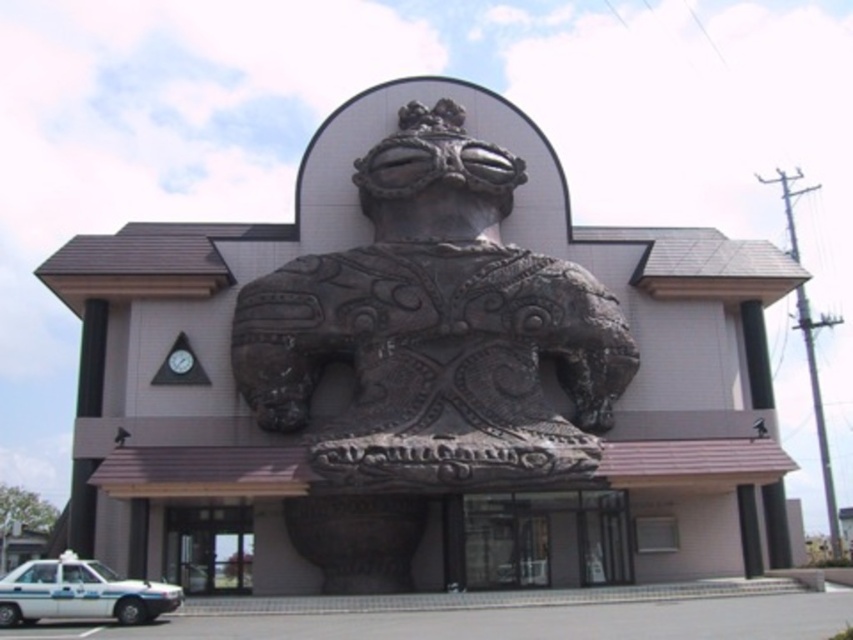
You are standing in front of the building and want to take a photo of the rustic stone statue at center. Where should you position yourself to ensure the statue is centered in your camera viewfinder?

The rustic stone statue at center is already positioned at the center coordinates of the image, so standing directly in front of the building and aligning your camera with the statue will ensure it is centered in your viewfinder.

You are standing in front of the building and notice two points marked on the facade. The first point is at coordinates point (453, 344) and the second is at point (74, 577). Which point is closer to you?

Point (74, 577) is closer to you because it is closer to the camera than point (453, 344), which is further away.

You are standing in front of the building and want to locate the point at coordinates (434, 332). Based on the scene description, where would this point be located?

The point at coordinates (434, 332) is located on the rustic stone statue at center.